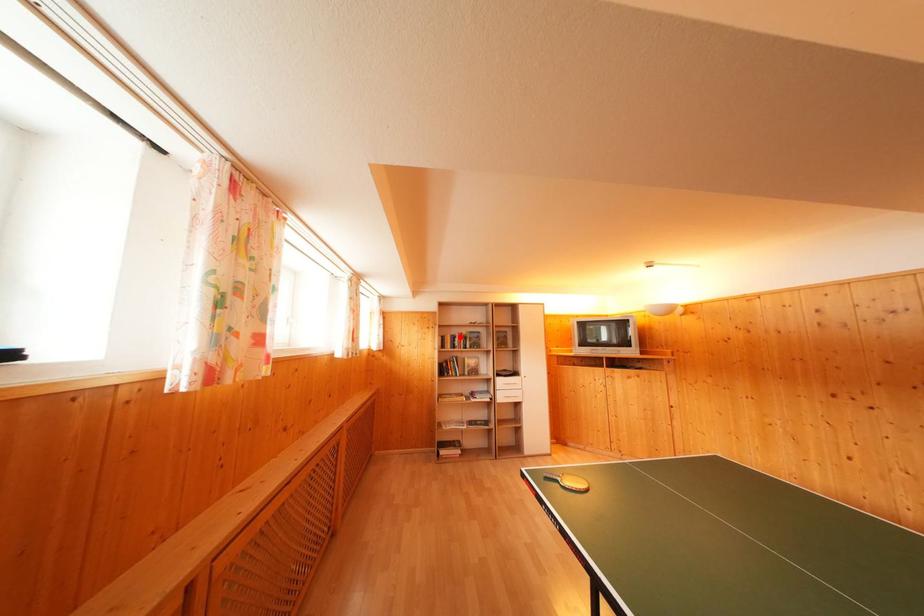
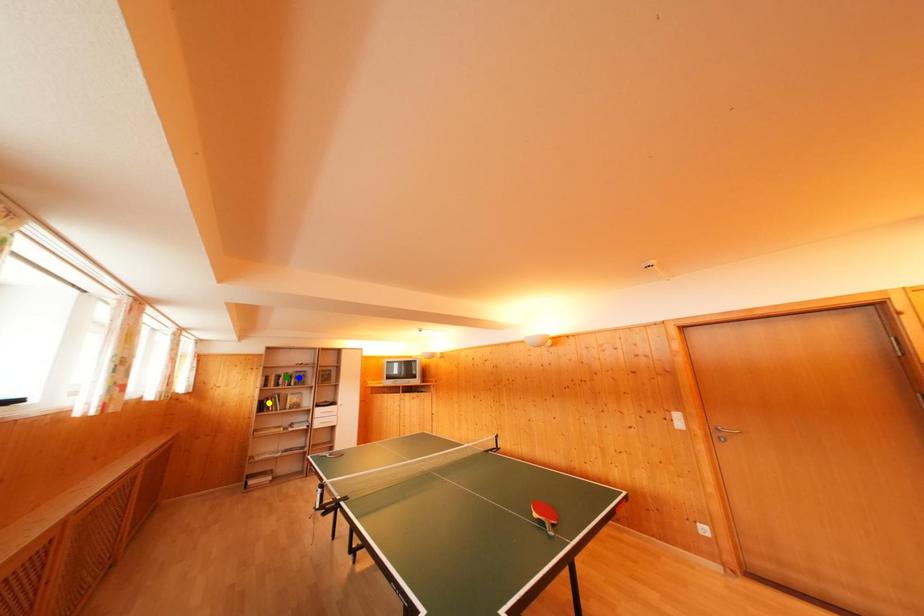
Question: I am providing you with two images of the same scene from different viewpoints. A red point is marked on the first image. You are given multiple points on the second image. Which mark in image 2 goes with the point in image 1?

Choices:
 (A) blue point
 (B) yellow point
 (C) green point

Answer: (C)